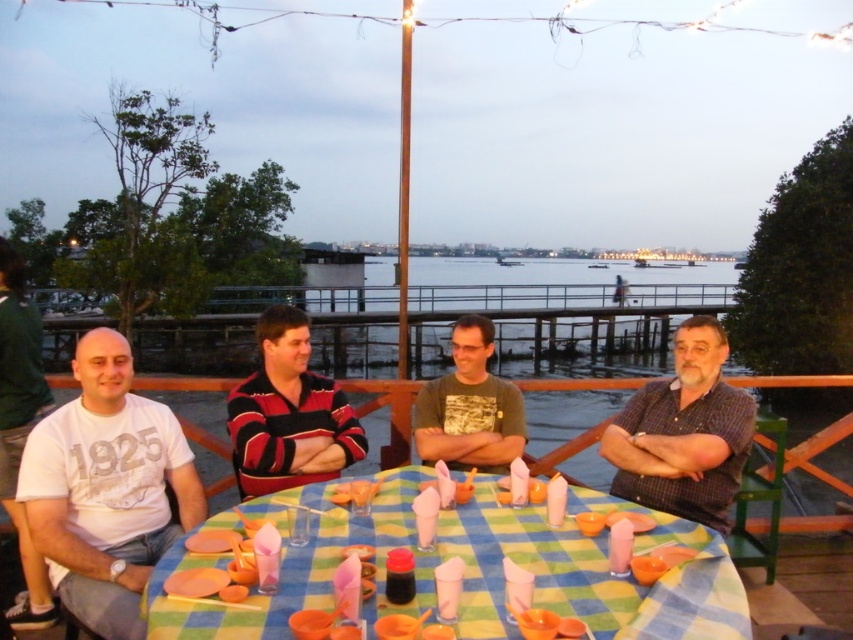
Question: Among these points, which one is nearest to the camera?

Choices:
 (A) (463, 326)
 (B) (65, 518)
 (C) (332, 406)
 (D) (711, 385)

Answer: (B)

Question: Is plaid shirt at right wider than striped jersey at center?

Choices:
 (A) no
 (B) yes

Answer: (B)

Question: Where is checkered fabric table at center located in relation to striped jersey at center in the image?

Choices:
 (A) left
 (B) right

Answer: (B)

Question: Which point is closer to the camera?

Choices:
 (A) checkered fabric table at center
 (B) camouflage t-shirt at center
 (C) white cotton t-shirt at left
 (D) plaid shirt at right

Answer: (A)

Question: Which of the following is the farthest from the observer?

Choices:
 (A) white cotton t-shirt at left
 (B) checkered fabric table at center
 (C) striped jersey at center

Answer: (C)

Question: Can you confirm if striped jersey at center is smaller than camouflage t-shirt at center?

Choices:
 (A) yes
 (B) no

Answer: (B)